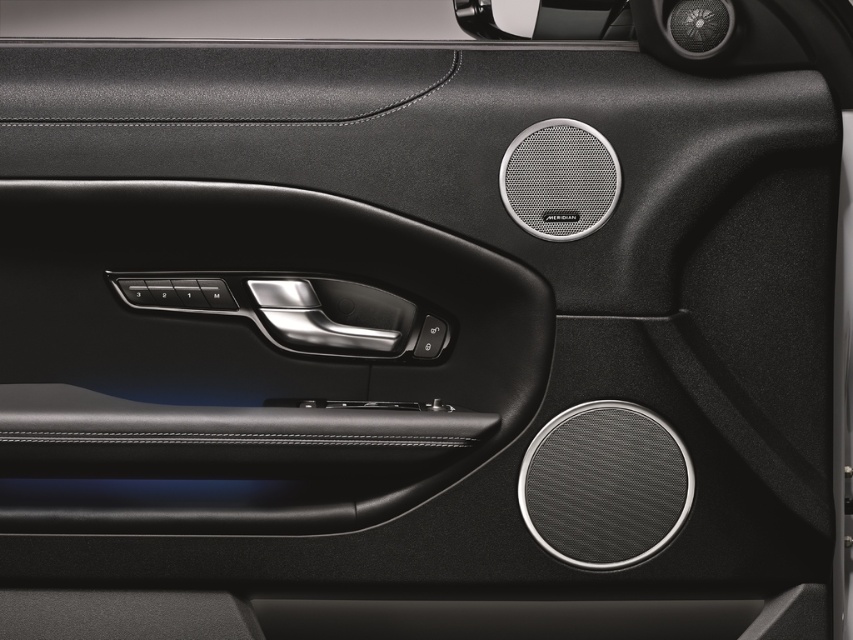
From the picture: Please describe the location of the black leather door handle at center in the car door panel using the coordinate system provided in the scene description.

The black leather door handle at center is located at coordinate point (245, 358).

You are designing a car interior and want to ensure that both the black leather door handle at center and the black metallic door handle at center are visible to the driver. Given their sizes, which handle might be easier to notice due to its size?

The black leather door handle at center has a larger width than the black metallic door handle at center, so it might be easier to notice due to its larger size.